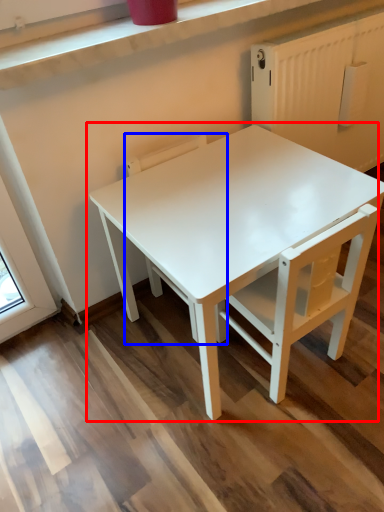
Question: Which of the following is the farthest to the observer, table (highlighted by a red box) or chair (highlighted by a blue box)?

Choices:
 (A) table
 (B) chair

Answer: (B)